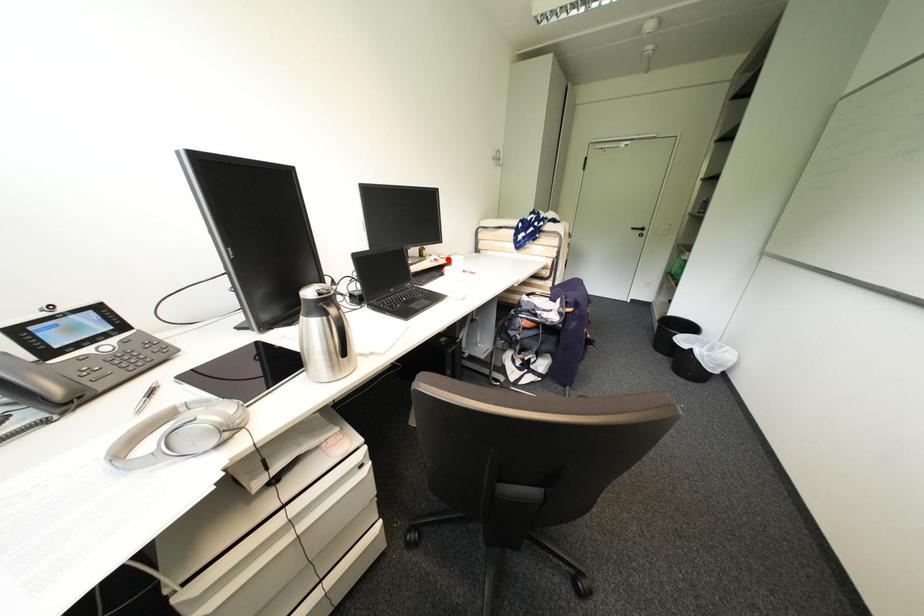
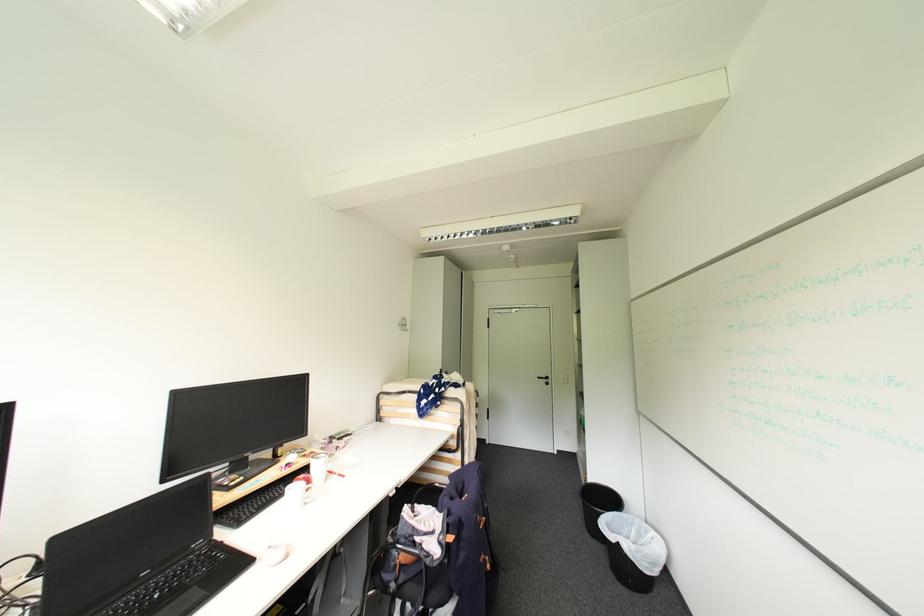
In the second image, find the point that corresponds to the highlighted location in the first image.

(311, 456)